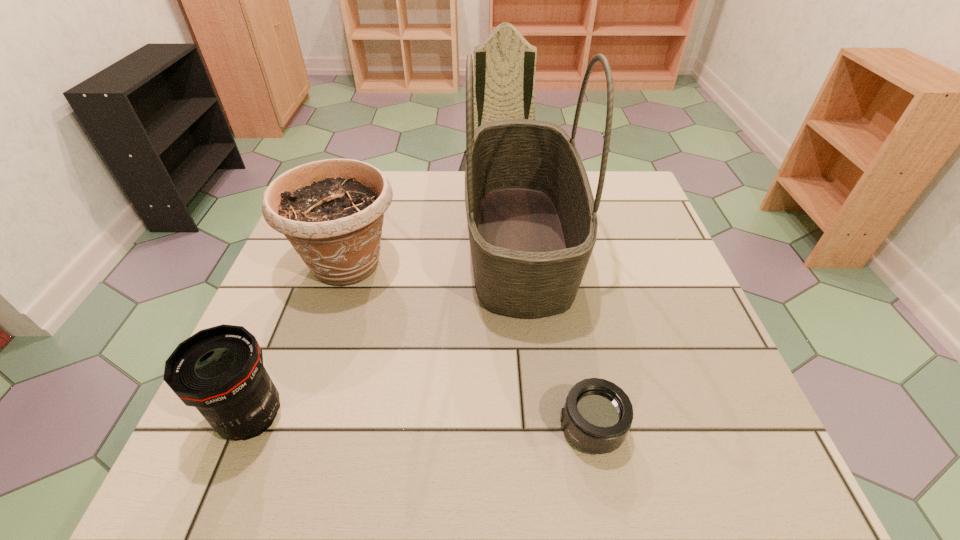
Find the location of a particular element. This screenshot has height=540, width=960. blank space located 0.150m on the side of the right telephoto lens with brand markings and control switches is located at coordinates (472, 427).

Where is `free space located on the side of the right telephoto lens with brand markings and control switches`? free space located on the side of the right telephoto lens with brand markings and control switches is located at coordinates (397, 427).

Image resolution: width=960 pixels, height=540 pixels. In order to click on object present at the far edge in this screenshot , I will do `click(532, 220)`.

This screenshot has width=960, height=540. Identify the location of flowerpot located in the left edge section of the desktop. (331, 211).

Locate an element on the screen. telephoto lens that is positioned at the left edge is located at coordinates (219, 370).

I want to click on object that is at the near left corner, so click(x=219, y=370).

Where is `free space at the far edge of the desktop`? Image resolution: width=960 pixels, height=540 pixels. free space at the far edge of the desktop is located at coordinates point(454,184).

Where is `vacant region at the near edge of the desktop`? vacant region at the near edge of the desktop is located at coordinates (367, 453).

Locate an element on the screen. The width and height of the screenshot is (960, 540). blank space at the left edge of the desktop is located at coordinates (281, 303).

Where is `free point at the right edge`? The height and width of the screenshot is (540, 960). free point at the right edge is located at coordinates (676, 434).